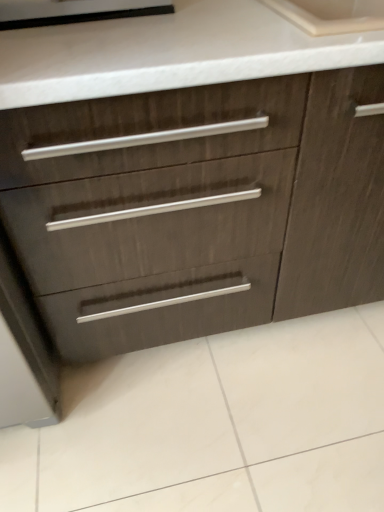
Question: Is black rubber seal at upper left in front of or behind dark wood cabinet at center in the image?

Choices:
 (A) front
 (B) behind

Answer: (B)

Question: Would you say black rubber seal at upper left is to the left or to the right of dark wood cabinet at center in the picture?

Choices:
 (A) left
 (B) right

Answer: (A)

Question: Is black rubber seal at upper left taller or shorter than dark wood cabinet at center?

Choices:
 (A) short
 (B) tall

Answer: (A)

Question: Visually, is dark wood cabinet at center positioned to the left or to the right of black rubber seal at upper left?

Choices:
 (A) right
 (B) left

Answer: (A)

Question: From a real-world perspective, is dark wood cabinet at center positioned above or below black rubber seal at upper left?

Choices:
 (A) below
 (B) above

Answer: (A)

Question: From their relative heights in the image, would you say dark wood cabinet at center is taller or shorter than black rubber seal at upper left?

Choices:
 (A) tall
 (B) short

Answer: (A)

Question: From the image's perspective, relative to black rubber seal at upper left, is dark wood cabinet at center above or below?

Choices:
 (A) below
 (B) above

Answer: (A)